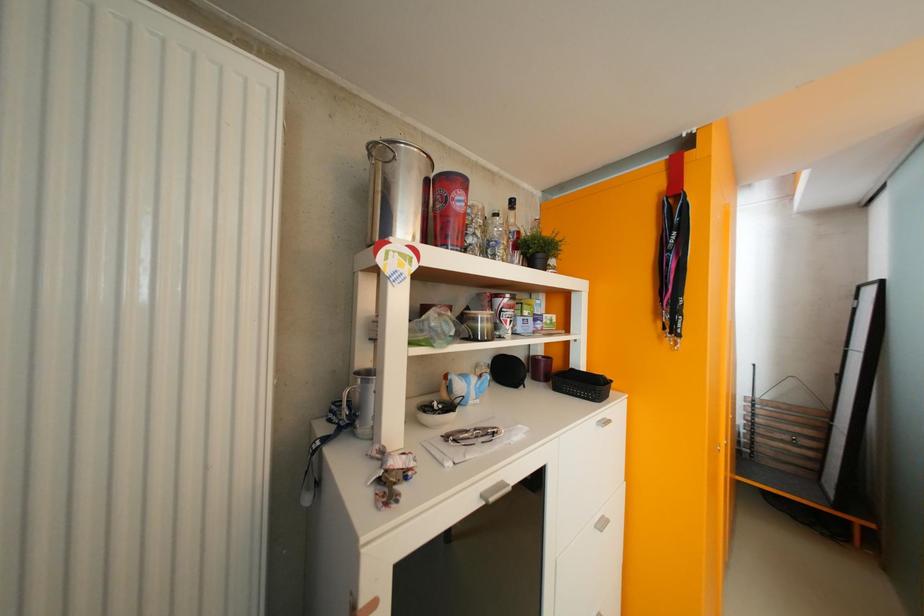
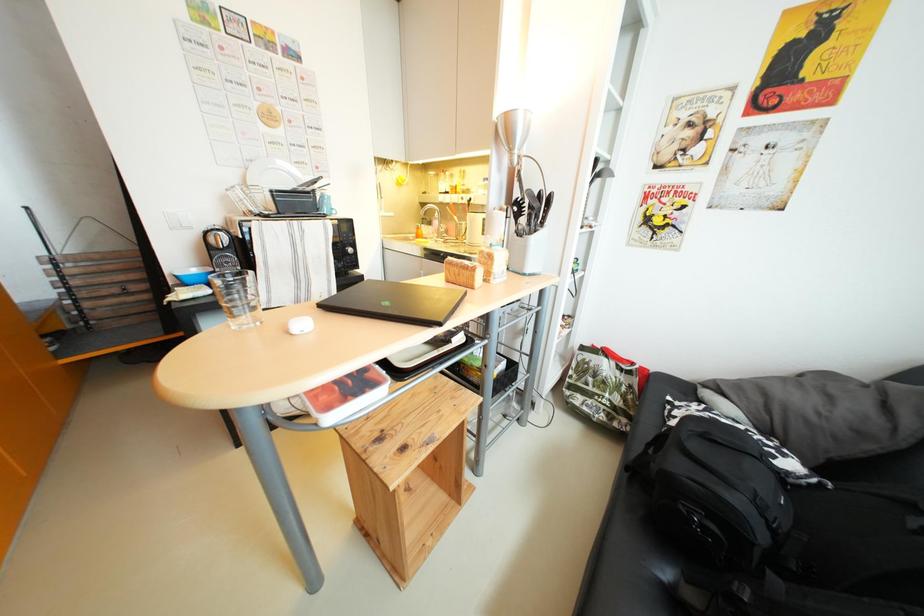
Based on the continuous images, in which direction is the camera rotating?

The rotation direction of the camera is right-down.